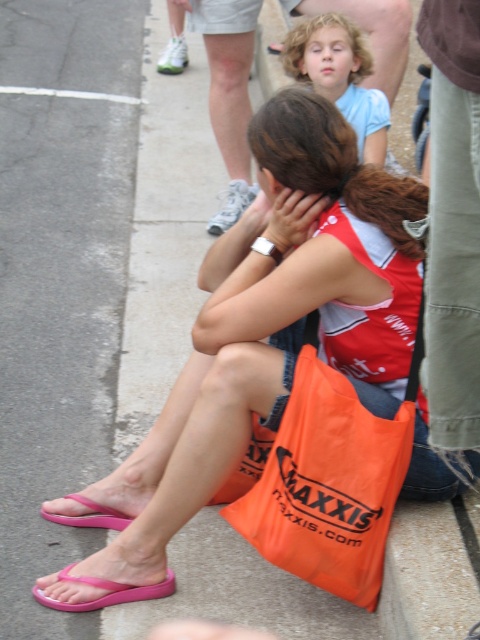
Question: Does orange fabric bag at lower center have a larger size compared to light blue fabric shirt at upper center?

Choices:
 (A) yes
 (B) no

Answer: (B)

Question: Estimate the real-world distances between objects in this image. Which object is farther from the light blue fabric shirt at upper center?

Choices:
 (A) orange fabric bag at lower center
 (B) pink rubber sandal at lower left

Answer: (B)

Question: Which point is closer to the camera?

Choices:
 (A) pink rubber flip-flop at lower left
 (B) pink rubber flip-flops at lower left

Answer: (B)

Question: Is pink rubber flip-flops at lower left closer to the viewer compared to orange fabric bag at lower center?

Choices:
 (A) yes
 (B) no

Answer: (B)

Question: Estimate the real-world distances between objects in this image. Which object is closer to the orange fabric bag at lower center?

Choices:
 (A) pink rubber flip-flops at lower left
 (B) light blue fabric shirt at upper center
 (C) pink rubber sandal at lower left
 (D) pink rubber flip-flop at lower left

Answer: (C)

Question: Considering the relative positions of orange fabric bag at lower center and pink rubber sandal at lower left in the image provided, where is orange fabric bag at lower center located with respect to pink rubber sandal at lower left?

Choices:
 (A) right
 (B) left

Answer: (A)